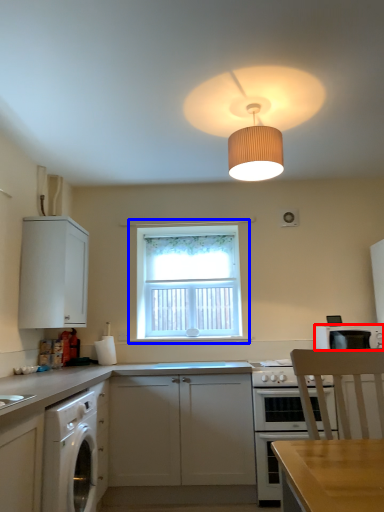
Question: Which of the following is the closest to the observer, kitchen appliance (highlighted by a red box) or window (highlighted by a blue box)?

Choices:
 (A) kitchen appliance
 (B) window

Answer: (A)